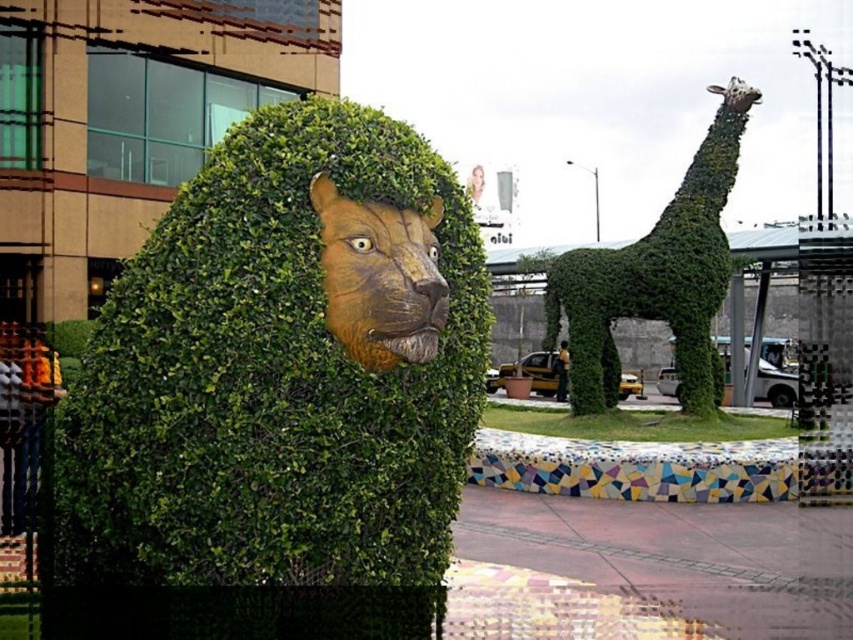
Which is behind, point (695, 156) or point (434, 276)?

Point (695, 156)

Is green leafy giraffe at right smaller than brown textured lion head at center?

No, green leafy giraffe at right is not smaller than brown textured lion head at center.

Is point (618, 301) closer to viewer compared to point (439, 330)?

No, (618, 301) is further to viewer.

Find the location of a particular element. Image resolution: width=853 pixels, height=640 pixels. green leafy giraffe at right is located at coordinates [x=657, y=275].

Which is in front, point (440, 520) or point (432, 300)?

Positioned in front is point (432, 300).

Identify the location of green leafy hedge at center. (283, 368).

You are a GUI agent. You are given a task and a screenshot of the screen. Output one action in this format:
    pyautogui.click(x=<x>, y=<y>)
    Task: Click on the green leafy hedge at center
    
    Given the screenshot: What is the action you would take?
    pyautogui.click(x=283, y=368)

Does green leafy hedge at center appear over green leafy giraffe at right?

Incorrect, green leafy hedge at center is not positioned above green leafy giraffe at right.

Is point (291, 200) farther from viewer compared to point (701, 179)?

That is False.

Image resolution: width=853 pixels, height=640 pixels. Identify the location of green leafy hedge at center. (283, 368).